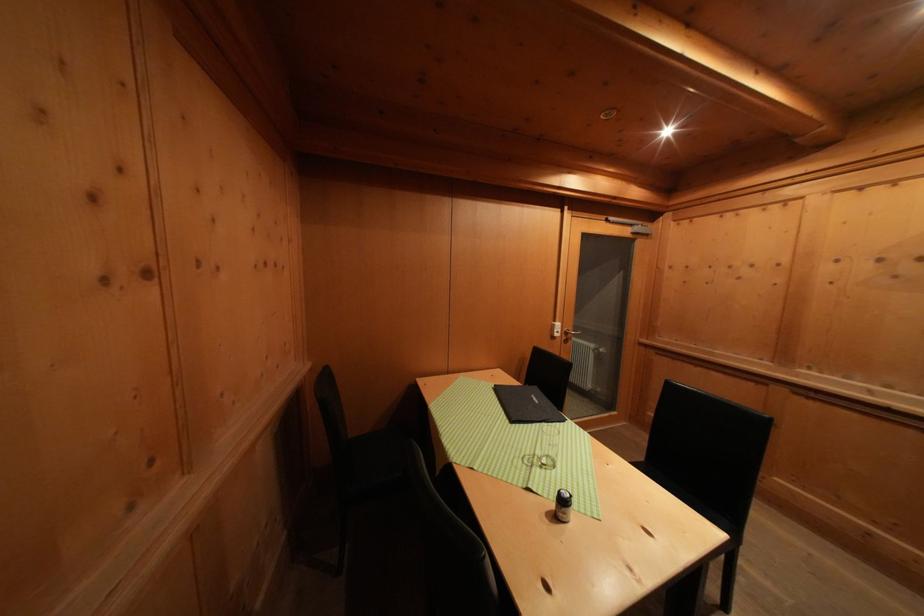
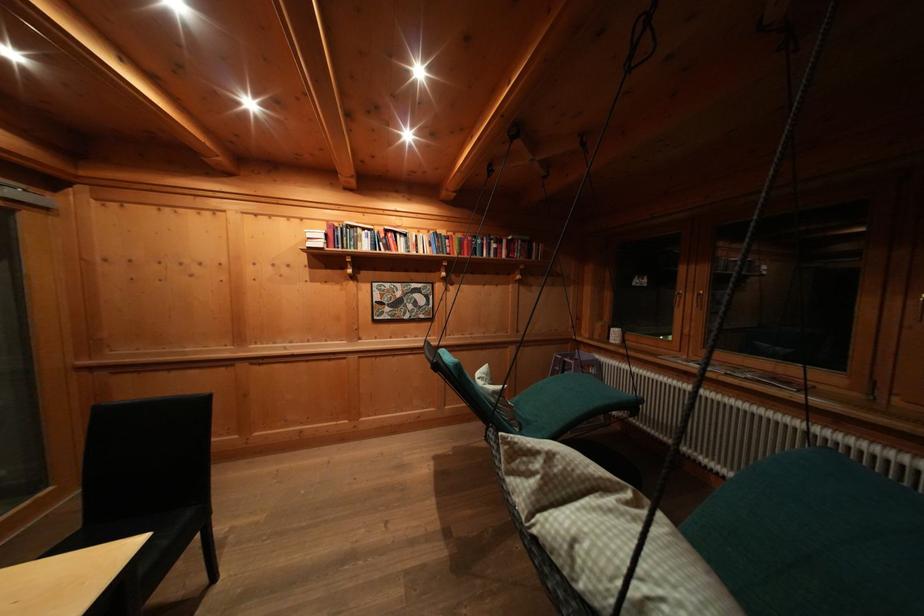
Question: The first image is from the beginning of the video and the second image is from the end. How did the camera likely rotate when shooting the video?

Choices:
 (A) Left
 (B) Right
 (C) Up
 (D) Down

Answer: (B)